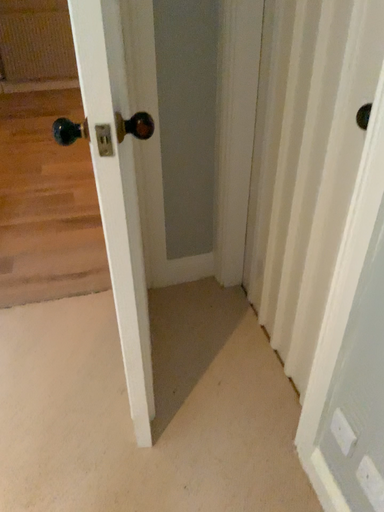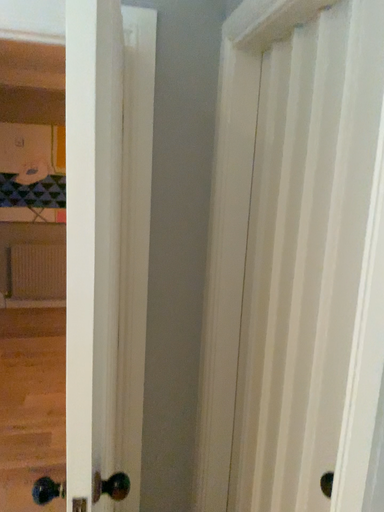
Question: How did the camera likely rotate when shooting the video?

Choices:
 (A) rotated downward
 (B) rotated upward

Answer: (B)